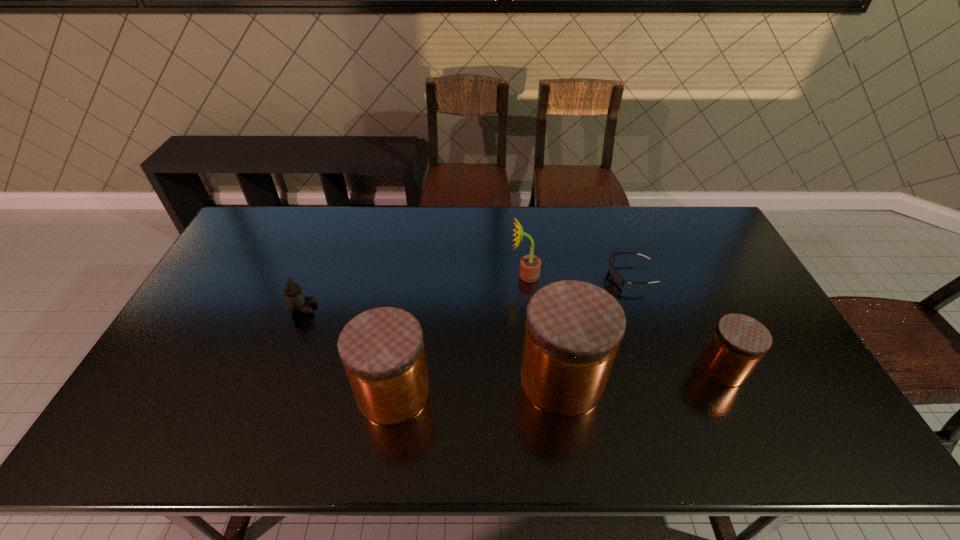
At what (x,y) coordinates should I click in order to perform the action: click on vacant spot to place a jar on the left. Please return your answer as a coordinate pair (x, y). The width and height of the screenshot is (960, 540). Looking at the image, I should click on (217, 405).